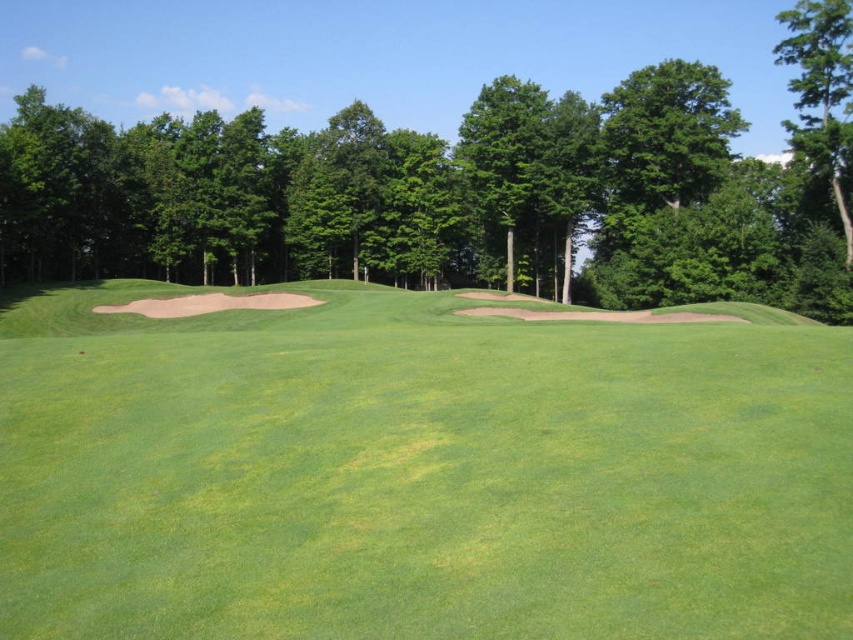
Does green leafy tree at center have a greater width compared to green leafy tree at upper right?

Indeed, green leafy tree at center has a greater width compared to green leafy tree at upper right.

Consider the image. Between green leafy tree at center and green leafy tree at upper right, which one appears on the left side from the viewer's perspective?

From the viewer's perspective, green leafy tree at center appears more on the left side.

What do you see at coordinates (463, 189) in the screenshot? This screenshot has width=853, height=640. I see `green leafy tree at center` at bounding box center [463, 189].

Where is `green leafy tree at center`? green leafy tree at center is located at coordinates (463, 189).

Who is positioned more to the right, green grassy field at center or green leafy tree at upper right?

green leafy tree at upper right

Is green grassy field at center further to camera compared to green leafy tree at upper right?

No, it is in front of green leafy tree at upper right.

Does point (428, 577) lie behind point (831, 129)?

No, (428, 577) is in front of (831, 129).

The image size is (853, 640). I want to click on green grassy field at center, so click(418, 474).

How much distance is there between green grassy field at center and green leafy tree at center?

They are 46.20 meters apart.

Does green grassy field at center appear on the left side of green leafy tree at center?

In fact, green grassy field at center is to the right of green leafy tree at center.

Does point (685, 616) come farther from viewer compared to point (827, 248)?

That is False.

Locate an element on the screen. The height and width of the screenshot is (640, 853). green grassy field at center is located at coordinates (418, 474).